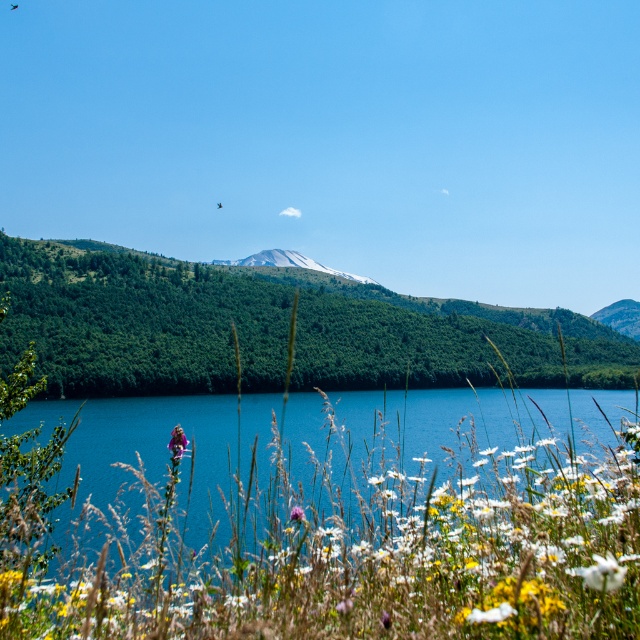
The width and height of the screenshot is (640, 640). I want to click on green leafy hillside at center, so click(138, 321).

Is green leafy hillside at center smaller than snowy rock mountain at center?

Incorrect, green leafy hillside at center is not smaller in size than snowy rock mountain at center.

Find the location of a particular element. green leafy hillside at center is located at coordinates (138, 321).

Is blue water at center positioned at the back of snowy rock mountain at center?

No, blue water at center is in front of snowy rock mountain at center.

Between blue water at center and snowy rock mountain at center, which one is positioned lower?

blue water at center is below.

You are a GUI agent. You are given a task and a screenshot of the screen. Output one action in this format:
    pyautogui.click(x=<x>, y=<y>)
    Task: Click on the blue water at center
    
    Given the screenshot: What is the action you would take?
    pyautogui.click(x=152, y=429)

Is point (618, 348) in front of point (486, 609)?

That is False.

Is green leafy hillside at center thinner than white fluffy flower at lower center?

No, green leafy hillside at center is not thinner than white fluffy flower at lower center.

I want to click on green leafy hillside at center, so click(x=138, y=321).

Locate an element on the screen. The image size is (640, 640). green leafy hillside at center is located at coordinates (138, 321).